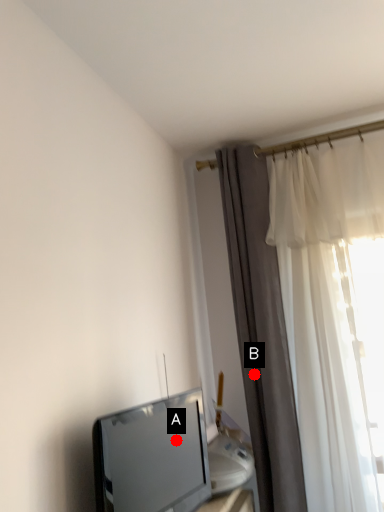
Question: Two points are circled on the image, labeled by A and B beside each circle. Which of the following is the closest to the observer?

Choices:
 (A) A is closer
 (B) B is closer

Answer: (A)